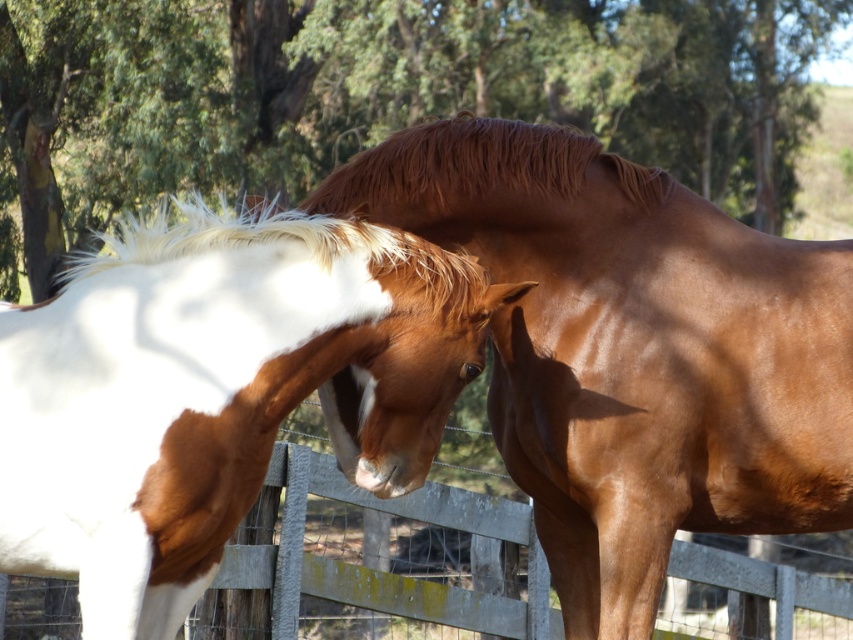
Question: Is shiny brown horse at center to the left of wooden fence at lower center from the viewer's perspective?

Choices:
 (A) yes
 (B) no

Answer: (B)

Question: Which object is farther from the camera taking this photo?

Choices:
 (A) shiny brown horse at center
 (B) wooden fence at lower center

Answer: (B)

Question: Is shiny brown horse at center in front of wooden fence at lower center?

Choices:
 (A) yes
 (B) no

Answer: (A)

Question: Does white glossy horse at left have a lesser width compared to wooden fence at lower center?

Choices:
 (A) yes
 (B) no

Answer: (B)

Question: Which point is farther to the camera?

Choices:
 (A) wooden fence at lower center
 (B) white glossy horse at left

Answer: (A)

Question: Which point is closer to the camera taking this photo?

Choices:
 (A) (456, 520)
 (B) (598, 227)
 (C) (115, 339)

Answer: (C)